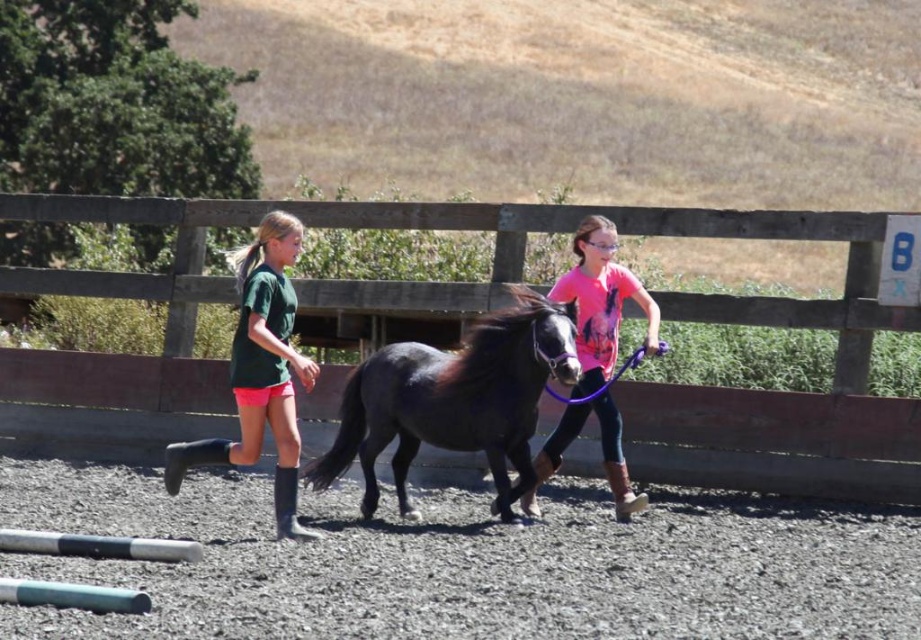
Can you confirm if gray gravel at center is positioned to the right of wooden fence at center?

In fact, gray gravel at center is to the left of wooden fence at center.

Is gray gravel at center taller than wooden fence at center?

No, gray gravel at center is not taller than wooden fence at center.

At what (x,y) coordinates should I click in order to perform the action: click on gray gravel at center. Please return your answer as a coordinate pair (x, y). This screenshot has width=921, height=640. Looking at the image, I should click on (465, 563).

Can you confirm if shiny black horse at center is smaller than green matte shorts at center?

No, shiny black horse at center is not smaller than green matte shorts at center.

Between shiny black horse at center and green matte shorts at center, which one appears on the left side from the viewer's perspective?

green matte shorts at center

The height and width of the screenshot is (640, 921). What do you see at coordinates (453, 401) in the screenshot?
I see `shiny black horse at center` at bounding box center [453, 401].

You are a GUI agent. You are given a task and a screenshot of the screen. Output one action in this format:
    pyautogui.click(x=<x>, y=<y>)
    Task: Click on the shiny black horse at center
    
    Given the screenshot: What is the action you would take?
    pyautogui.click(x=453, y=401)

Is point (471, 563) closer to camera compared to point (537, 339)?

That is True.

Can you confirm if gray gravel at center is positioned below shiny black horse at center?

Indeed, gray gravel at center is positioned under shiny black horse at center.

Between point (850, 600) and point (491, 372), which one is positioned in front?

Point (850, 600) is more forward.

I want to click on gray gravel at center, so click(465, 563).